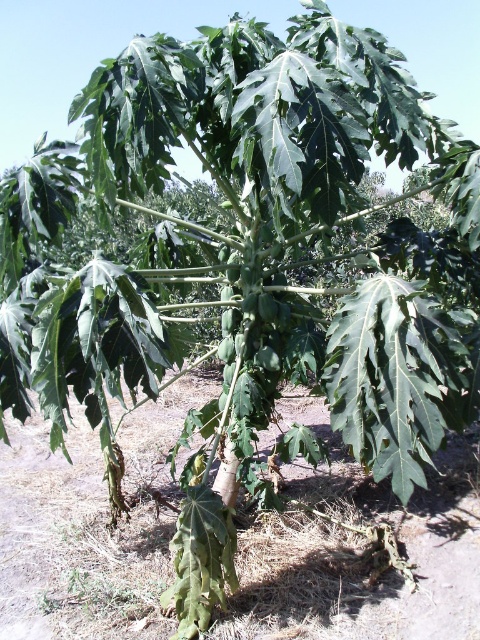
In the scene shown: Does brown dry soil at center have a greater height compared to green matte papaya at center?

No.

This screenshot has height=640, width=480. Find the location of `brown dry soil at center`. brown dry soil at center is located at coordinates (359, 554).

Image resolution: width=480 pixels, height=640 pixels. Identify the location of brown dry soil at center. (359, 554).

This screenshot has width=480, height=640. Find the location of `brown dry soil at center`. brown dry soil at center is located at coordinates (359, 554).